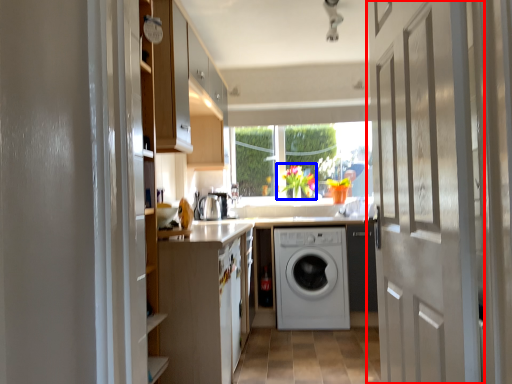
Question: Which object appears closest to the camera in this image, door (highlighted by a red box) or floral arrangement (highlighted by a blue box)?

Choices:
 (A) door
 (B) floral arrangement

Answer: (A)